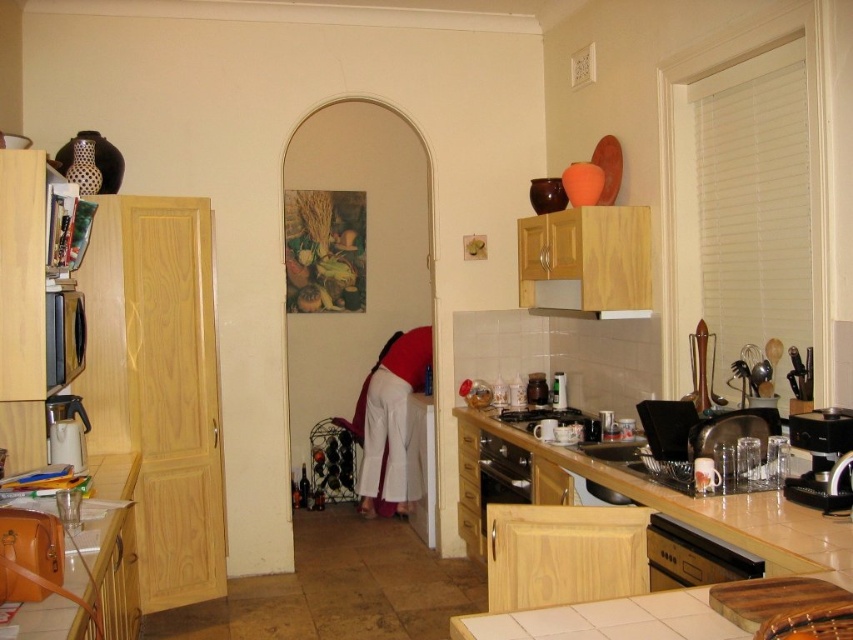
You are a kitchen designer planning to install a new appliance. You need to know which appliance is taller between the black stainless steel dishwasher at lower right and the wooden exhaust hood at upper center. Which one is taller?

The black stainless steel dishwasher at lower right is much taller than the wooden exhaust hood at upper center.

You are a barista setting up for a coffee event. You need to place the black plastic coffee maker at right closer to the wooden exhaust hood at upper center. How much distance do you need to move it to reach the hood?

The distance between the black plastic coffee maker at right and the wooden exhaust hood at upper center is 4.43 feet, so you need to move it 4.43 feet to reach the hood.

You are a new homeowner trying to install a new appliance in your kitchen. You want to place a new microwave oven above the black stainless steel dishwasher at lower right. Is there enough vertical space between the dishwasher and the wooden exhaust hood at upper center to fit the microwave?

The black stainless steel dishwasher at lower right is positioned under the wooden exhaust hood at upper center, which means there is vertical space between them. However, the exact dimensions are not provided, so it is uncertain if the microwave will fit without measuring the distance between the dishwasher and the hood.